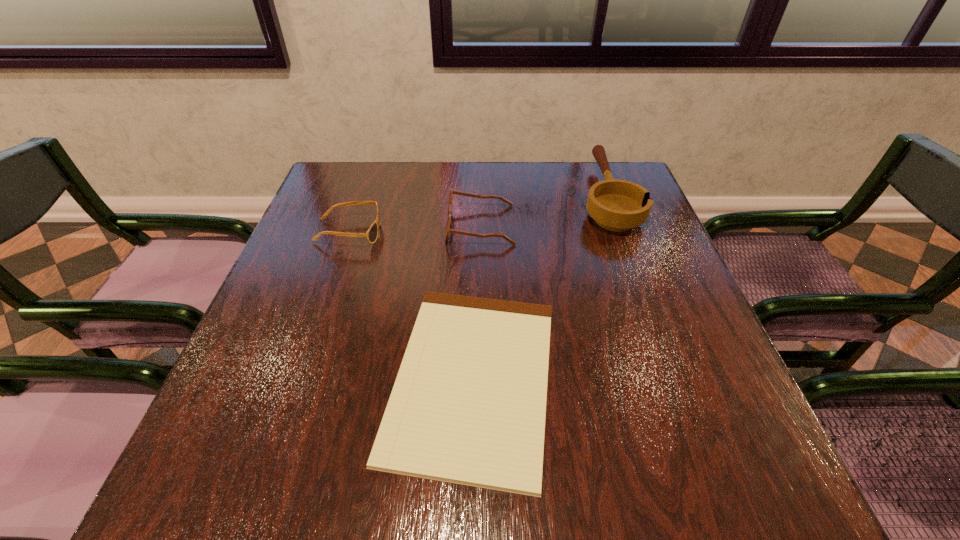
I want to click on the rightmost object, so click(617, 205).

The width and height of the screenshot is (960, 540). I want to click on spectacles, so click(448, 230).

Identify the location of the leftmost object. This screenshot has width=960, height=540. (371, 235).

The image size is (960, 540). Find the location of `sunglasses`. sunglasses is located at coordinates (371, 235).

Locate an element on the screen. The image size is (960, 540). the nearest object is located at coordinates (468, 406).

Where is `the shortest object`? Image resolution: width=960 pixels, height=540 pixels. the shortest object is located at coordinates (468, 406).

At what (x,y) coordinates should I click in order to perform the action: click on free space located on the front-facing side of the spectacles. Please return your answer as a coordinate pair (x, y). The image size is (960, 540). Looking at the image, I should click on (396, 225).

Locate an element on the screen. free location located on the front-facing side of the spectacles is located at coordinates (420, 225).

I want to click on blank area located on the front-facing side of the spectacles, so (319, 225).

In order to click on vacant space located on the front-facing side of the sunglasses in this screenshot , I will do `click(475, 232)`.